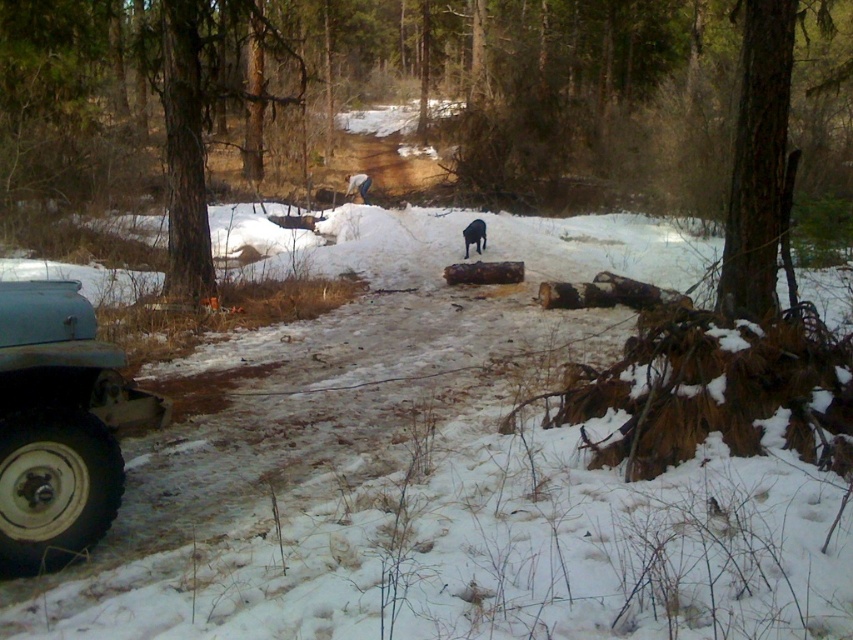
Question: Can you confirm if brown rough tree at upper right is positioned to the right of black fur dog at center?

Choices:
 (A) no
 (B) yes

Answer: (B)

Question: Considering the real-world distances, which object is farthest from the shiny metallic dog at center?

Choices:
 (A) brown wood tree at center
 (B) rusty metal jeep at lower left
 (C) brown rough tree at upper right

Answer: (B)

Question: Is rusty metal jeep at lower left to the left of black fur dog at center from the viewer's perspective?

Choices:
 (A) yes
 (B) no

Answer: (A)

Question: Estimate the real-world distances between objects in this image. Which object is closer to the shiny metallic dog at center?

Choices:
 (A) brown wood tree at center
 (B) brown rough tree at upper right
 (C) black fur dog at center
 (D) rusty metal jeep at lower left

Answer: (C)

Question: Does brown rough tree at upper right have a larger size compared to shiny metallic dog at center?

Choices:
 (A) yes
 (B) no

Answer: (A)

Question: Which is nearer to the rusty metal jeep at lower left?

Choices:
 (A) brown wood tree at center
 (B) brown rough tree at upper right

Answer: (B)